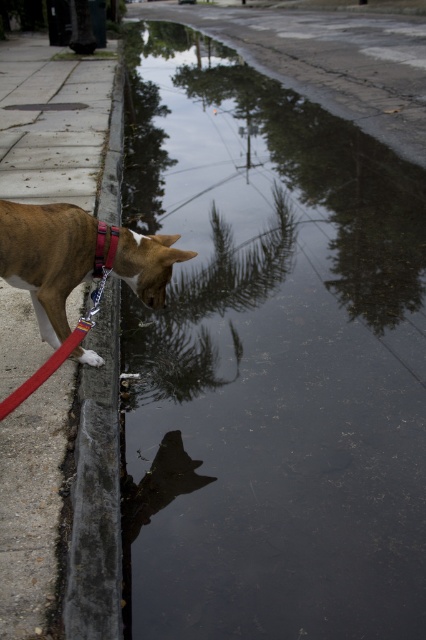
Between point (408, 516) and point (71, 280), which one is positioned behind?

The point (71, 280) is more distant.

Who is lower down, glossy reflective water at lower center or brown matte dog at left?

brown matte dog at left is below.

Is point (253, 580) farther from viewer compared to point (60, 234)?

No, it is in front of (60, 234).

I want to click on glossy reflective water at lower center, so click(x=270, y=360).

Can you confirm if glossy reflective water at lower center is shorter than concrete at left?

No.

How much distance is there between glossy reflective water at lower center and concrete at left?

5.02 feet

I want to click on glossy reflective water at lower center, so click(x=270, y=360).

Consider the image. How much distance is there between concrete at left and brown matte dog at left?

concrete at left is 70.05 centimeters from brown matte dog at left.

How much distance is there between concrete at left and brown matte dog at left?

concrete at left is 27.58 inches away from brown matte dog at left.

Does point (118, 448) come behind point (160, 262)?

That is False.

Identify the location of concrete at left. This screenshot has width=426, height=640. (97, 490).